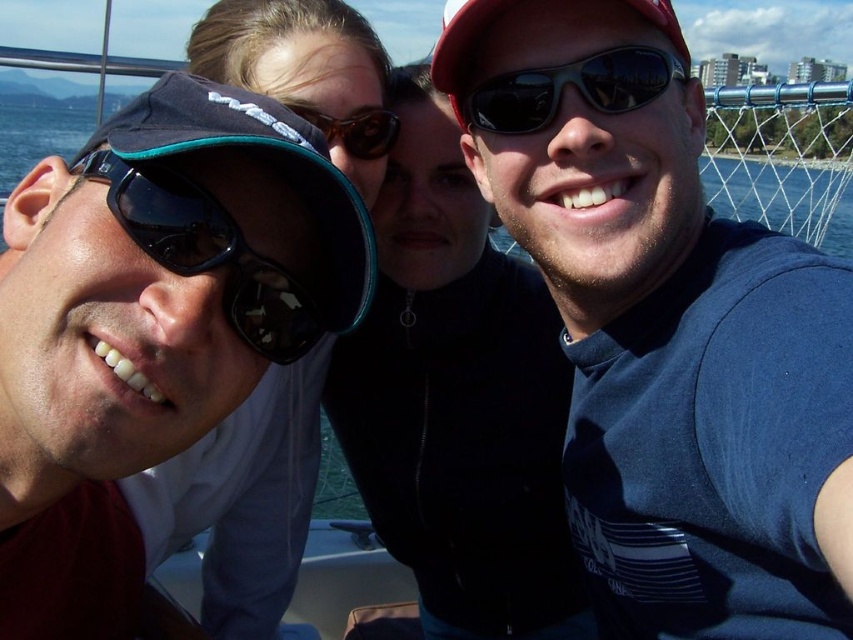
Question: Does blue fabric shirt at center appear over sunglasses at center?

Choices:
 (A) yes
 (B) no

Answer: (B)

Question: Is matte black goggles at left below sunglasses at center?

Choices:
 (A) yes
 (B) no

Answer: (A)

Question: Which point is closer to the camera?

Choices:
 (A) matte black goggles at left
 (B) sunglasses at center

Answer: (A)

Question: Is matte black cap at left smaller than matte black goggles at left?

Choices:
 (A) yes
 (B) no

Answer: (A)

Question: Which object is the farthest from the blue fabric shirt at center?

Choices:
 (A) matte black jacket at center
 (B) matte black cap at left
 (C) sunglasses at center

Answer: (B)

Question: Among these objects, which one is nearest to the camera?

Choices:
 (A) matte black goggles at left
 (B) brown reflective sunglasses at center
 (C) matte black jacket at center
 (D) matte black cap at left

Answer: (A)